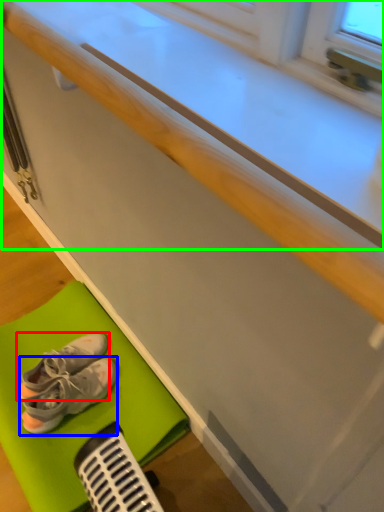
Question: Which is farther away from footwear (highlighted by a red box)? footwear (highlighted by a blue box) or counter top (highlighted by a green box)?

Choices:
 (A) footwear
 (B) counter top

Answer: (B)